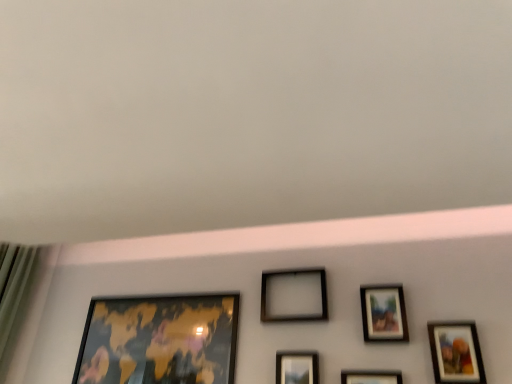
Question: Are gold metallic map at lower left, which is the first picture frame in left-to-right order, and matte wooden picture frame at lower right, positioned as the 1th picture frame in right-to-left order, located far from each other?

Choices:
 (A) yes
 (B) no

Answer: (B)

Question: Is gold metallic map at lower left, the 6th picture frame viewed from the right, facing towards matte wooden picture frame at lower right, which appears as the sixth picture frame when viewed from the left?

Choices:
 (A) yes
 (B) no

Answer: (B)

Question: Considering the relative sizes of gold metallic map at lower left, which is the first picture frame in left-to-right order, and matte wooden picture frame at lower right, positioned as the 1th picture frame in right-to-left order, in the image provided, is gold metallic map at lower left, which is the first picture frame in left-to-right order, wider than matte wooden picture frame at lower right, positioned as the 1th picture frame in right-to-left order,?

Choices:
 (A) no
 (B) yes

Answer: (B)

Question: Is gold metallic map at lower left, which is the first picture frame in left-to-right order, located outside matte wooden picture frame at lower right, which appears as the sixth picture frame when viewed from the left?

Choices:
 (A) yes
 (B) no

Answer: (A)

Question: Is gold metallic map at lower left, which is the first picture frame in left-to-right order, bigger than matte wooden picture frame at lower right, which appears as the sixth picture frame when viewed from the left?

Choices:
 (A) no
 (B) yes

Answer: (B)

Question: From the image's perspective, is gold metallic map at lower left, the 6th picture frame viewed from the right, over matte wooden picture frame at lower right, which appears as the sixth picture frame when viewed from the left?

Choices:
 (A) yes
 (B) no

Answer: (B)

Question: Are black matte picture frame at center, which ranks as the 3th picture frame in left-to-right order, and matte black picture frame at center, the fourth picture frame viewed from the left, making contact?

Choices:
 (A) yes
 (B) no

Answer: (B)

Question: Could you tell me if black matte picture frame at center, acting as the fourth picture frame starting from the right, is facing matte black picture frame at center, which ranks as the 3th picture frame in right-to-left order?

Choices:
 (A) no
 (B) yes

Answer: (A)

Question: Can you confirm if black matte picture frame at center, acting as the fourth picture frame starting from the right, is smaller than matte black picture frame at center, which ranks as the 3th picture frame in right-to-left order?

Choices:
 (A) no
 (B) yes

Answer: (A)

Question: Can you confirm if black matte picture frame at center, which ranks as the 3th picture frame in left-to-right order, is taller than matte black picture frame at center, the fourth picture frame viewed from the left?

Choices:
 (A) no
 (B) yes

Answer: (B)

Question: From a real-world perspective, is black matte picture frame at center, which ranks as the 3th picture frame in left-to-right order, under matte black picture frame at center, the fourth picture frame viewed from the left?

Choices:
 (A) no
 (B) yes

Answer: (A)

Question: Considering the relative sizes of black matte picture frame at center, which ranks as the 3th picture frame in left-to-right order, and matte black picture frame at center, the fourth picture frame viewed from the left, in the image provided, is black matte picture frame at center, which ranks as the 3th picture frame in left-to-right order, shorter than matte black picture frame at center, the fourth picture frame viewed from the left,?

Choices:
 (A) yes
 (B) no

Answer: (B)

Question: Is matte black picture frame at center, which ranks as the 3th picture frame in right-to-left order, bigger than matte wooden picture frame at lower right, positioned as the 1th picture frame in right-to-left order?

Choices:
 (A) yes
 (B) no

Answer: (A)